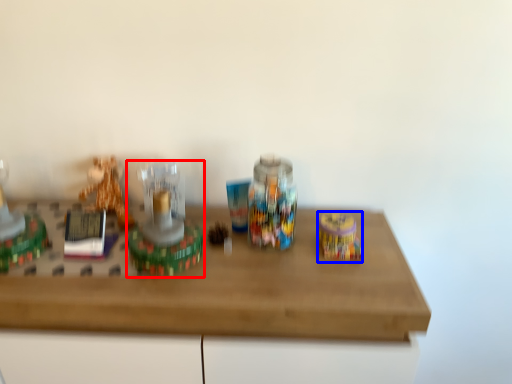
Question: Which point is further to the camera, toy (highlighted by a red box) or toy (highlighted by a blue box)?

Choices:
 (A) toy
 (B) toy

Answer: (B)